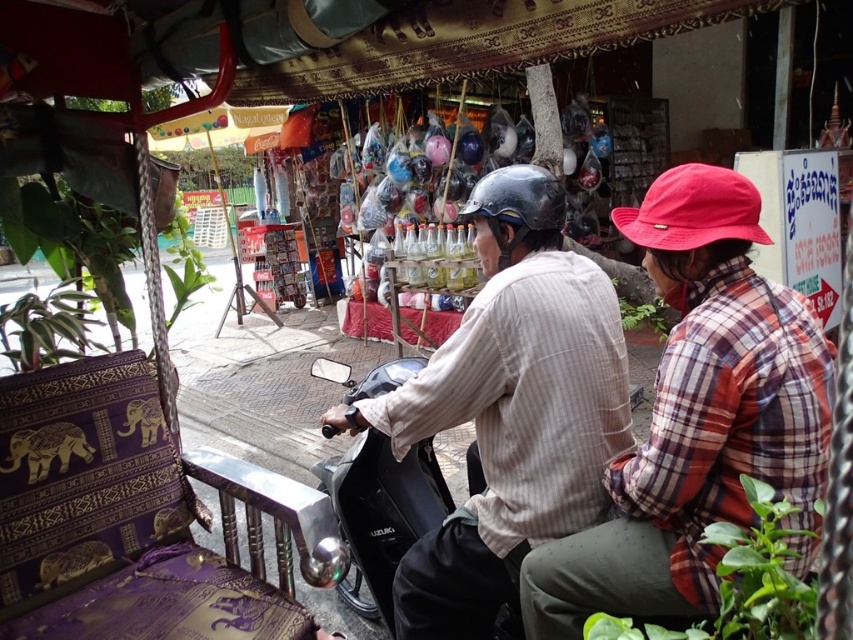
Can you confirm if plaid fabric shirt at center is taller than striped cotton shirt at center?

No.

Is plaid fabric shirt at center to the right of striped cotton shirt at center from the viewer's perspective?

Correct, you'll find plaid fabric shirt at center to the right of striped cotton shirt at center.

I want to click on plaid fabric shirt at center, so click(698, 417).

Where is `plaid fabric shirt at center`? This screenshot has width=853, height=640. plaid fabric shirt at center is located at coordinates point(698,417).